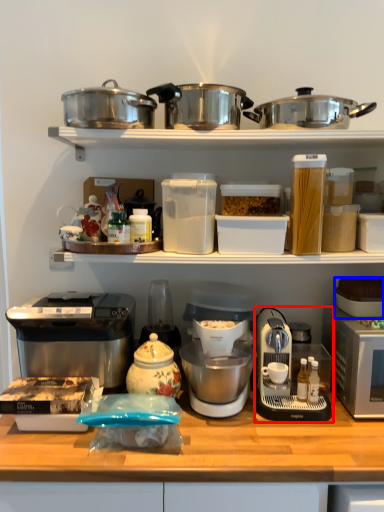
Question: Among these objects, which one is nearest to the camera, coffee maker (highlighted by a red box) or appliance (highlighted by a blue box)?

Choices:
 (A) coffee maker
 (B) appliance

Answer: (A)